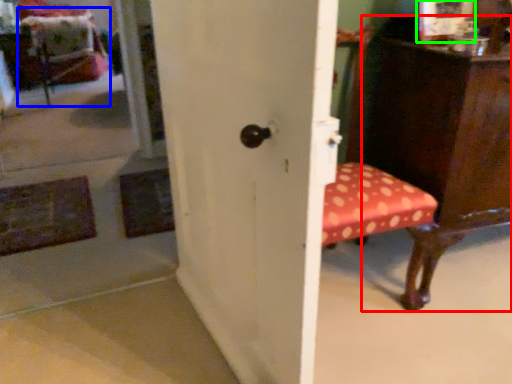
Question: Which object is positioned farthest from furniture (highlighted by a red box)? Select from swivel chair (highlighted by a blue box) and picture frame (highlighted by a green box).

Choices:
 (A) swivel chair
 (B) picture frame

Answer: (A)